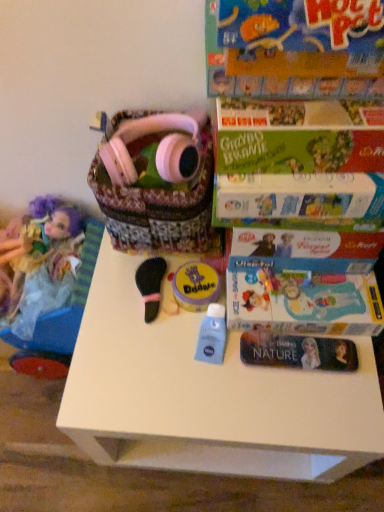
Where is `free location in front of matte cardboard book at upper right, acting as the 2th paperback book starting from the front`? free location in front of matte cardboard book at upper right, acting as the 2th paperback book starting from the front is located at coordinates (284, 401).